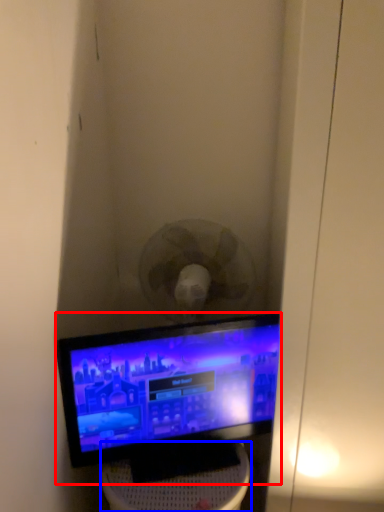
Question: Which point is further to the camera, computer monitor (highlighted by a red box) or furniture (highlighted by a blue box)?

Choices:
 (A) computer monitor
 (B) furniture

Answer: (A)